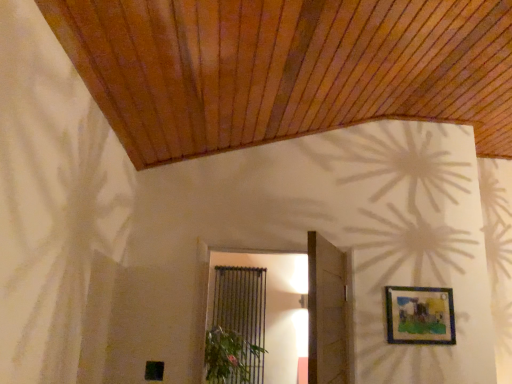
Question: Does black metal screen door at center lie behind wooden door at center?

Choices:
 (A) no
 (B) yes

Answer: (B)

Question: From a real-world perspective, is black metal screen door at center physically above wooden door at center?

Choices:
 (A) no
 (B) yes

Answer: (B)

Question: Is black metal screen door at center positioned before wooden door at center?

Choices:
 (A) no
 (B) yes

Answer: (A)

Question: Can you confirm if black metal screen door at center is wider than wooden door at center?

Choices:
 (A) no
 (B) yes

Answer: (B)

Question: From the image's perspective, does black metal screen door at center appear higher than wooden door at center?

Choices:
 (A) no
 (B) yes

Answer: (A)

Question: Is black metal screen door at center smaller than wooden door at center?

Choices:
 (A) no
 (B) yes

Answer: (B)

Question: Is black metal screen door at center directly adjacent to matte blue picture frame at upper right?

Choices:
 (A) yes
 (B) no

Answer: (B)

Question: Is black metal screen door at center oriented towards matte blue picture frame at upper right?

Choices:
 (A) no
 (B) yes

Answer: (A)

Question: From the image's perspective, does black metal screen door at center appear lower than matte blue picture frame at upper right?

Choices:
 (A) yes
 (B) no

Answer: (A)

Question: Considering the relative sizes of black metal screen door at center and matte blue picture frame at upper right in the image provided, is black metal screen door at center wider than matte blue picture frame at upper right?

Choices:
 (A) yes
 (B) no

Answer: (A)

Question: Does black metal screen door at center have a smaller size compared to matte blue picture frame at upper right?

Choices:
 (A) yes
 (B) no

Answer: (B)

Question: Does black metal screen door at center come in front of matte blue picture frame at upper right?

Choices:
 (A) no
 (B) yes

Answer: (A)

Question: From a real-world perspective, does black metal screen door at center stand above green leafy plant at lower center?

Choices:
 (A) yes
 (B) no

Answer: (A)